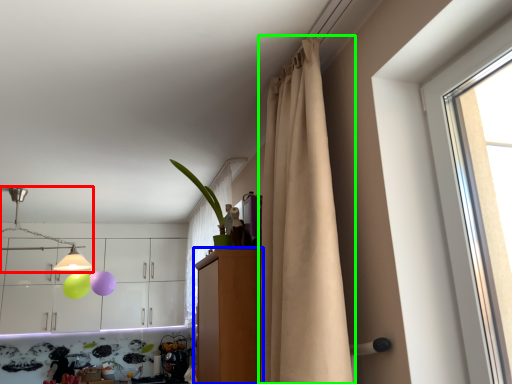
Question: Based on their relative distances, which object is nearer to lamp (highlighted by a red box)? Choose from dresser (highlighted by a blue box) and curtain (highlighted by a green box).

Choices:
 (A) dresser
 (B) curtain

Answer: (A)